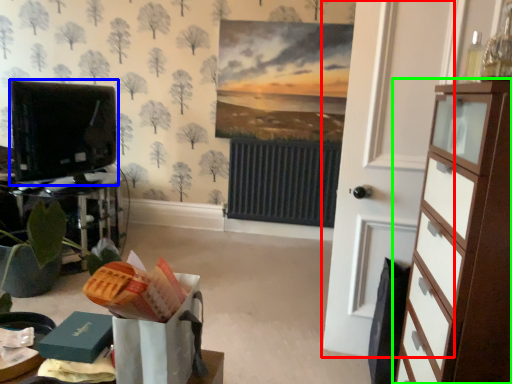
Question: Estimate the real-world distances between objects in this image. Which object is farther from door (highlighted by a red box), electronic (highlighted by a blue box) or chest of drawers (highlighted by a green box)?

Choices:
 (A) electronic
 (B) chest of drawers

Answer: (A)